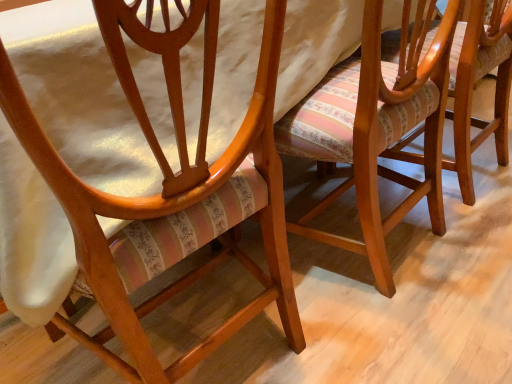
Question: From the image's perspective, is striped fabric cushion at center, which ranks as the 1th chair in right-to-left order, positioned above or below matte wood chair at center, the 3th chair positioned from the right?

Choices:
 (A) above
 (B) below

Answer: (A)

Question: Is striped fabric cushion at center, which ranks as the 1th chair in right-to-left order, inside the boundaries of matte wood chair at center, marked as the 1th chair in a left-to-right arrangement, or outside?

Choices:
 (A) inside
 (B) outside

Answer: (B)

Question: Which is nearer to the wooden chair with striped upholstery at center, which is counted as the second chair, starting from the right?

Choices:
 (A) striped fabric cushion at center, which ranks as the 1th chair in right-to-left order
 (B) matte wood chair at center, marked as the 1th chair in a left-to-right arrangement

Answer: (A)

Question: Which object is the closest to the matte wood chair at center, the 3th chair positioned from the right?

Choices:
 (A) wooden chair with striped upholstery at center, which ranks as the 2th chair in left-to-right order
 (B) striped fabric cushion at center, which ranks as the 1th chair in right-to-left order

Answer: (A)